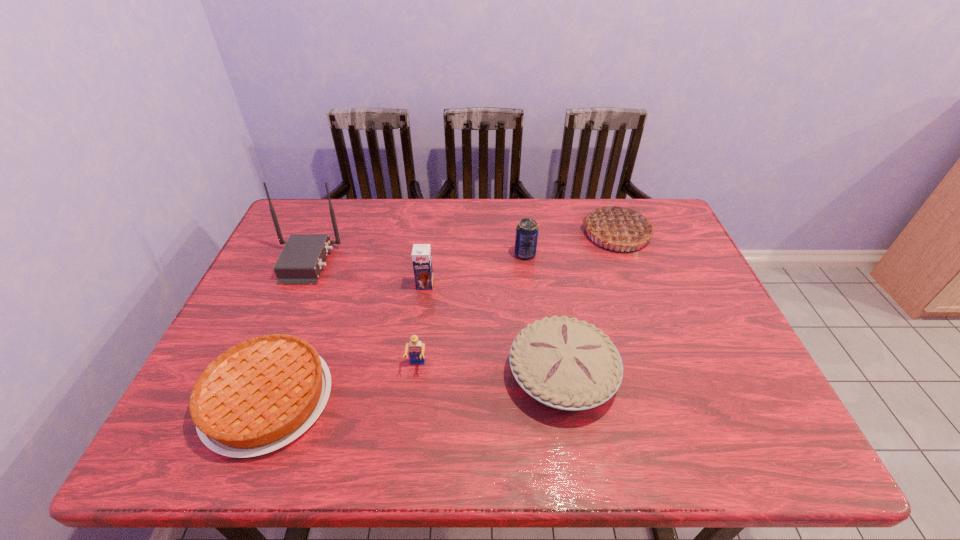
Image resolution: width=960 pixels, height=540 pixels. Find the location of `router`. router is located at coordinates (300, 262).

Find the location of a particular element. the rightmost pie is located at coordinates (x=619, y=226).

You are a GUI agent. You are given a task and a screenshot of the screen. Output one action in this format:
    pyautogui.click(x=<x>, y=<y>)
    Task: Click on the rightmost object
    The image size is (960, 540).
    Given the screenshot: What is the action you would take?
    pyautogui.click(x=619, y=226)

Find the location of a particular element. The width and height of the screenshot is (960, 540). chocolate milk is located at coordinates (421, 254).

Locate an element on the screen. soda is located at coordinates (527, 230).

Find the location of a particular element. The width and height of the screenshot is (960, 540). Lego is located at coordinates click(x=416, y=349).

Identify the location of the second tallest pie. This screenshot has width=960, height=540. (566, 364).

The height and width of the screenshot is (540, 960). I want to click on the shortest object, so click(x=258, y=396).

Identify the location of the shortest pie. Image resolution: width=960 pixels, height=540 pixels. (258, 396).

The width and height of the screenshot is (960, 540). In order to click on vacant space located 0.110m on the back of the router to connect cables in this screenshot , I will do `click(374, 262)`.